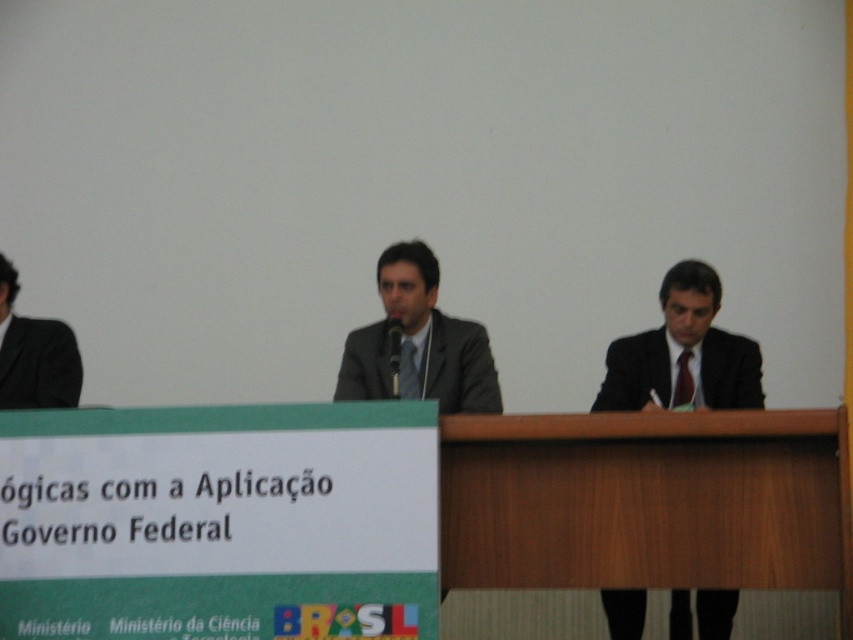
Question: Does wooden at right appear on the left side of black suit at center?

Choices:
 (A) no
 (B) yes

Answer: (B)

Question: Does wooden at right appear on the left side of black suit at center?

Choices:
 (A) yes
 (B) no

Answer: (A)

Question: Which point is farther to the camera?

Choices:
 (A) (577, 486)
 (B) (413, 368)

Answer: (B)

Question: Is matte gray suit at center bigger than black suit at left?

Choices:
 (A) no
 (B) yes

Answer: (B)

Question: Which object is the farthest from the black suit at center?

Choices:
 (A) wooden at right
 (B) black suit at left
 (C) matte gray suit at center

Answer: (B)

Question: Which point is farther from the camera taking this photo?

Choices:
 (A) (447, 406)
 (B) (759, 381)
 (C) (28, 326)
 (D) (505, 540)

Answer: (B)